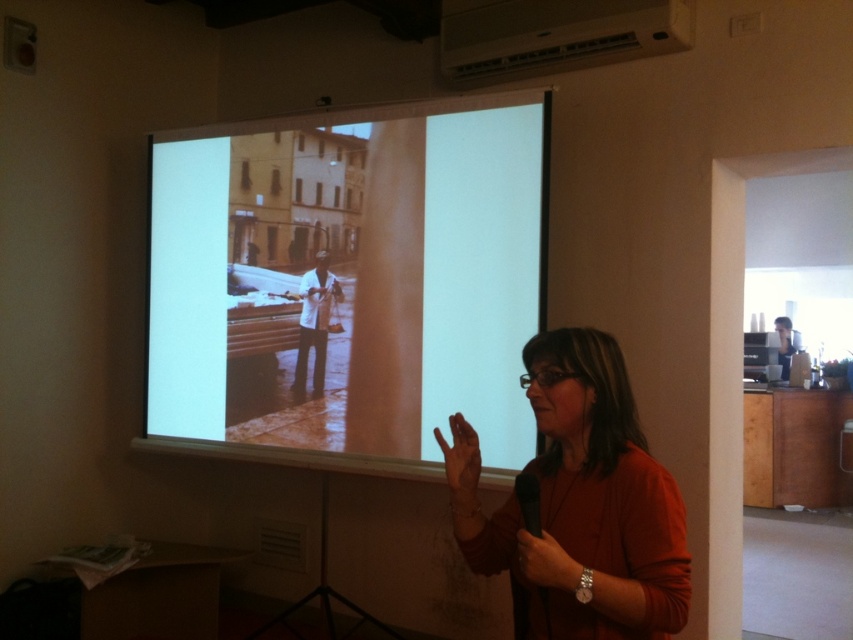
Is matte orange sweater at center further to the viewer compared to smooth black hand at lower right?

No.

Who is lower down, matte orange sweater at center or smooth black hand at lower right?

Positioned lower is smooth black hand at lower right.

Who is more distant from viewer, (662, 627) or (576, 586)?

Positioned behind is point (576, 586).

At what (x,y) coordinates should I click in order to perform the action: click on matte orange sweater at center. Please return your answer as a coordinate pair (x, y). Looking at the image, I should click on point(589,504).

Is point (399, 262) closer to camera compared to point (450, 429)?

That is False.

Between point (373, 227) and point (459, 483), which one is positioned behind?

The point (373, 227) is behind.

Image resolution: width=853 pixels, height=640 pixels. Find the location of `white matte projection screen at center`. white matte projection screen at center is located at coordinates (350, 280).

Does white matte projection screen at center appear on the left side of smooth black hand at lower right?

Correct, you'll find white matte projection screen at center to the left of smooth black hand at lower right.

Which is in front, point (503, 243) or point (555, 588)?

Point (555, 588) is more forward.

Where is `white matte projection screen at center`? This screenshot has height=640, width=853. white matte projection screen at center is located at coordinates (350, 280).

Identify the location of white matte projection screen at center. The image size is (853, 640). (350, 280).